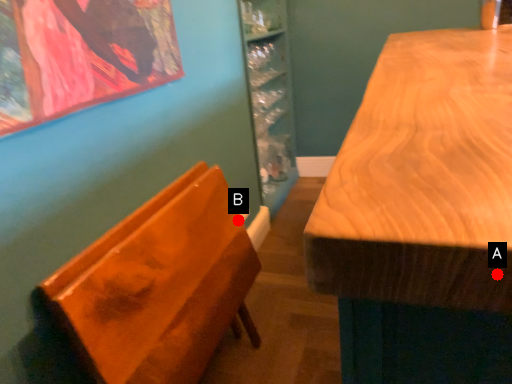
Question: Two points are circled on the image, labeled by A and B beside each circle. Which point appears closest to the camera in this image?

Choices:
 (A) A is closer
 (B) B is closer

Answer: (A)